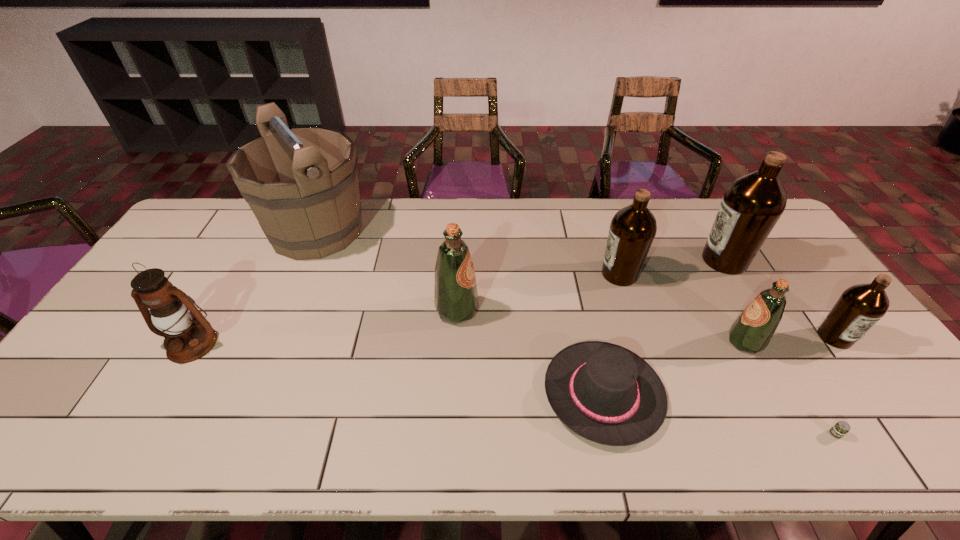
Where is `object that is positioned at the far edge`? This screenshot has width=960, height=540. object that is positioned at the far edge is located at coordinates (301, 183).

Where is `dress hat present at the near edge`? dress hat present at the near edge is located at coordinates (606, 393).

Locate an element on the screen. The width and height of the screenshot is (960, 540). beer can that is at the near edge is located at coordinates (841, 428).

The width and height of the screenshot is (960, 540). In the image, there is a desktop. What are the coordinates of `vacant space at the far edge` in the screenshot? It's located at (574, 199).

Where is `vacant region at the left edge of the desktop`? The height and width of the screenshot is (540, 960). vacant region at the left edge of the desktop is located at coordinates (192, 287).

Locate an element on the screen. Image resolution: width=960 pixels, height=540 pixels. vacant space at the far left corner of the desktop is located at coordinates (219, 225).

The image size is (960, 540). Identify the location of free location at the near right corner. [x=873, y=444].

Image resolution: width=960 pixels, height=540 pixels. Identify the location of free spot between the smallest brown olive oil and the beer can. (835, 386).

Locate an element on the screen. Image resolution: width=960 pixels, height=540 pixels. free point between the beer can and the nearest brown olive oil is located at coordinates (835, 386).

Locate an element on the screen. This screenshot has width=960, height=540. free area in between the rightmost object and the beer can is located at coordinates (835, 386).